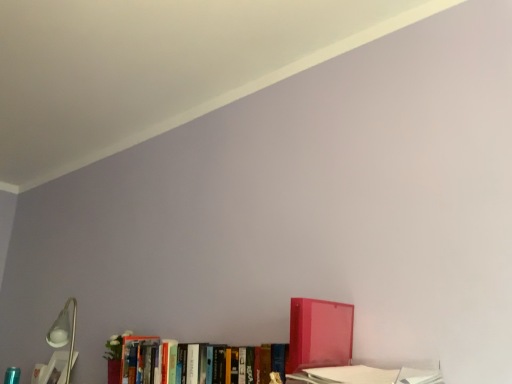
The height and width of the screenshot is (384, 512). What are the coordinates of `hardcover book at lower left, which is counted as the 3th book, starting from the front` in the screenshot? It's located at (52, 369).

Measure the distance between hardcover books at center, the second book in the right-to-left sequence, and camera.

hardcover books at center, the second book in the right-to-left sequence, is 1.13 meters away from camera.

Find the location of a particular element. This screenshot has height=384, width=512. hardcover book at lower left, which is the 1th book in left-to-right order is located at coordinates (52, 369).

Considering the relative sizes of hardcover book at lower left, which is counted as the 3th book, starting from the front, and translucent red binder at lower right, which is counted as the 3th book, starting from the left, in the image provided, is hardcover book at lower left, which is counted as the 3th book, starting from the front, wider than translucent red binder at lower right, which is counted as the 3th book, starting from the left,?

In fact, hardcover book at lower left, which is counted as the 3th book, starting from the front, might be narrower than translucent red binder at lower right, which is counted as the 3th book, starting from the left.

How much distance is there between hardcover book at lower left, placed as the 1th book when sorted from back to front, and translucent red binder at lower right, which is the third book in back-to-front order?

The distance of hardcover book at lower left, placed as the 1th book when sorted from back to front, from translucent red binder at lower right, which is the third book in back-to-front order, is 3.88 feet.

From the image's perspective, is hardcover book at lower left, which is counted as the 3th book, starting from the right, positioned above or below translucent red binder at lower right, arranged as the first book when viewed from the right?

From the image's perspective, hardcover book at lower left, which is counted as the 3th book, starting from the right, appears below translucent red binder at lower right, arranged as the first book when viewed from the right.

Is translucent red binder at lower right, which is the third book in back-to-front order, surrounded by hardcover book at lower left, which is the 1th book in left-to-right order?

No.

Would you say hardcover books at center, the 2th book from the front, is part of hardcover book at lower left, which is the 1th book in left-to-right order,'s contents?

No, hardcover books at center, the 2th book from the front, is not surrounded by hardcover book at lower left, which is the 1th book in left-to-right order.

Considering the positions of objects hardcover book at lower left, which is counted as the 3th book, starting from the front, and hardcover books at center, the 2th book from the front, in the image provided, who is in front, hardcover book at lower left, which is counted as the 3th book, starting from the front, or hardcover books at center, the 2th book from the front,?

hardcover books at center, the 2th book from the front, is more forward.

Is hardcover book at lower left, placed as the 1th book when sorted from back to front, turned away from hardcover books at center, marked as the second book in a left-to-right arrangement?

No, hardcover book at lower left, placed as the 1th book when sorted from back to front,'s orientation is not away from hardcover books at center, marked as the second book in a left-to-right arrangement.

You are a GUI agent. You are given a task and a screenshot of the screen. Output one action in this format:
    pyautogui.click(x=<x>, y=<y>)
    Task: Click on the book below the hardcover books at center, the 2th book from the front (from the image's perspective)
    This screenshot has height=384, width=512.
    Given the screenshot: What is the action you would take?
    pyautogui.click(x=52, y=369)

Identify the location of book that appears above the hardcover books at center, the second book in the right-to-left sequence (from a real-world perspective). (319, 334).

From a real-world perspective, which object stands above the other?

translucent red binder at lower right, which is the third book in back-to-front order, from a real-world perspective.

Consider the image. From the image's perspective, which one is positioned higher, hardcover books at center, which is the 2th book from back to front, or translucent red binder at lower right, arranged as the first book when viewed from the right?

From the image's view, translucent red binder at lower right, arranged as the first book when viewed from the right, is above.

Does hardcover books at center, marked as the second book in a left-to-right arrangement, have a lesser height compared to translucent red binder at lower right, the 1th book from the front?

Indeed, hardcover books at center, marked as the second book in a left-to-right arrangement, has a lesser height compared to translucent red binder at lower right, the 1th book from the front.

Considering the sizes of objects translucent red binder at lower right, which is the third book in back-to-front order, and hardcover books at center, the second book in the right-to-left sequence, in the image provided, who is smaller, translucent red binder at lower right, which is the third book in back-to-front order, or hardcover books at center, the second book in the right-to-left sequence,?

Smaller between the two is translucent red binder at lower right, which is the third book in back-to-front order.

From the image's perspective, which object appears higher, translucent red binder at lower right, arranged as the first book when viewed from the right, or hardcover books at center, the second book in the right-to-left sequence?

translucent red binder at lower right, arranged as the first book when viewed from the right, is shown above in the image.

Is translucent red binder at lower right, which is counted as the 3th book, starting from the left, not inside hardcover books at center, marked as the second book in a left-to-right arrangement?

That's correct, translucent red binder at lower right, which is counted as the 3th book, starting from the left, is outside of hardcover books at center, marked as the second book in a left-to-right arrangement.

The image size is (512, 384). I want to click on book below the hardcover books at center, the second book in the right-to-left sequence (from a real-world perspective), so click(52, 369).

Is hardcover books at center, the second book in the right-to-left sequence, directly adjacent to hardcover book at lower left, which is counted as the 3th book, starting from the front?

No, hardcover books at center, the second book in the right-to-left sequence, is not with hardcover book at lower left, which is counted as the 3th book, starting from the front.

Looking at this image, considering the relative sizes of hardcover books at center, the second book in the right-to-left sequence, and hardcover book at lower left, placed as the 1th book when sorted from back to front, in the image provided, is hardcover books at center, the second book in the right-to-left sequence, shorter than hardcover book at lower left, placed as the 1th book when sorted from back to front,?

Yes.

Looking at this image, does translucent red binder at lower right, which is counted as the 3th book, starting from the left, lie in front of hardcover book at lower left, which is the 1th book in left-to-right order?

Yes, translucent red binder at lower right, which is counted as the 3th book, starting from the left, is closer to the camera.

In terms of size, does translucent red binder at lower right, which is counted as the 3th book, starting from the left, appear bigger or smaller than hardcover book at lower left, placed as the 1th book when sorted from back to front?

Clearly, translucent red binder at lower right, which is counted as the 3th book, starting from the left, is larger in size than hardcover book at lower left, placed as the 1th book when sorted from back to front.

Is translucent red binder at lower right, arranged as the first book when viewed from the right, positioned beyond the bounds of hardcover book at lower left, which is counted as the 3th book, starting from the front?

Yes, translucent red binder at lower right, arranged as the first book when viewed from the right, is outside of hardcover book at lower left, which is counted as the 3th book, starting from the front.

Who is shorter, translucent red binder at lower right, the 1th book from the front, or hardcover book at lower left, which is counted as the 3th book, starting from the right?

hardcover book at lower left, which is counted as the 3th book, starting from the right.

Where is `the 2nd book behind when counting from the translucent red binder at lower right, the 1th book from the front`? Image resolution: width=512 pixels, height=384 pixels. the 2nd book behind when counting from the translucent red binder at lower right, the 1th book from the front is located at coordinates (52, 369).

The height and width of the screenshot is (384, 512). Identify the location of the 1st book in front of the hardcover book at lower left, which is counted as the 3th book, starting from the front, starting your count from the anchor. (148, 360).

Which object lies further to the anchor point hardcover books at center, which is the 2th book from back to front, translucent red binder at lower right, which is counted as the 3th book, starting from the left, or hardcover book at lower left, which is the 1th book in left-to-right order?

hardcover book at lower left, which is the 1th book in left-to-right order, is positioned further to the anchor hardcover books at center, which is the 2th book from back to front.

Based on their spatial positions, is hardcover books at center, the second book in the right-to-left sequence, or translucent red binder at lower right, which is counted as the 3th book, starting from the left, further from hardcover book at lower left, which is the 1th book in left-to-right order?

Based on the image, translucent red binder at lower right, which is counted as the 3th book, starting from the left, appears to be further to hardcover book at lower left, which is the 1th book in left-to-right order.

Based on their spatial positions, is hardcover book at lower left, which is counted as the 3th book, starting from the front, or hardcover books at center, the second book in the right-to-left sequence, further from translucent red binder at lower right, arranged as the first book when viewed from the right?

hardcover book at lower left, which is counted as the 3th book, starting from the front.

Based on their spatial positions, is translucent red binder at lower right, the 1th book from the front, or hardcover books at center, which is the 2th book from back to front, closer to hardcover book at lower left, which is counted as the 3th book, starting from the right?

Based on the image, hardcover books at center, which is the 2th book from back to front, appears to be nearer to hardcover book at lower left, which is counted as the 3th book, starting from the right.

From the image, which object appears to be farther from hardcover books at center, which is the 2th book from back to front, hardcover book at lower left, which is counted as the 3th book, starting from the front, or translucent red binder at lower right, the 1th book from the front?

hardcover book at lower left, which is counted as the 3th book, starting from the front, is further to hardcover books at center, which is the 2th book from back to front.

Consider the image. From the image, which object appears to be farther from translucent red binder at lower right, the 1th book from the front, hardcover books at center, marked as the second book in a left-to-right arrangement, or hardcover book at lower left, which is the 1th book in left-to-right order?

hardcover book at lower left, which is the 1th book in left-to-right order, is further to translucent red binder at lower right, the 1th book from the front.

Locate an element on the screen. book situated between hardcover book at lower left, which is the 1th book in left-to-right order, and translucent red binder at lower right, which is the third book in back-to-front order, from left to right is located at coordinates (148, 360).